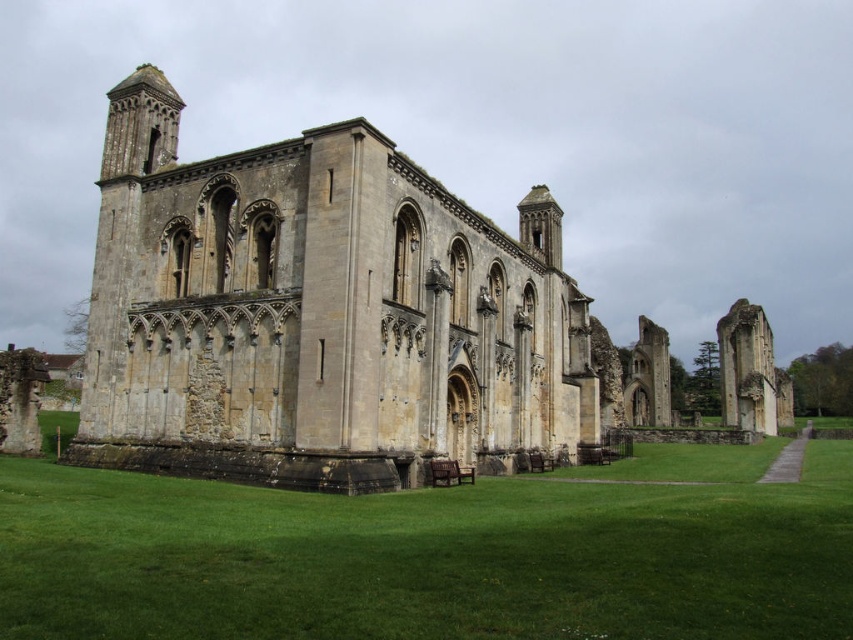
You are a visitor standing on the green grass at lower center and want to take a photo of the yellow stone ruins at center. Which object should you focus on to capture the entire structure in your shot?

The yellow stone ruins at center has a larger size compared to green grass at lower center, so you should focus on the yellow stone ruins at center to ensure the entire structure fits in the frame.